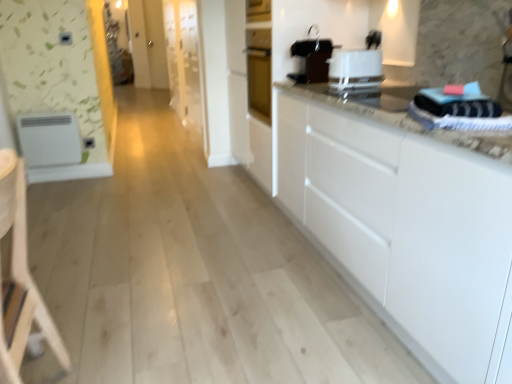
Consider the image. How much space does white matte refrigerator at left, arranged as the first appliance when viewed from the back, occupy horizontally?

white matte refrigerator at left, arranged as the first appliance when viewed from the back, is 5.27 inches wide.

Describe the element at coordinates (20, 281) in the screenshot. I see `light wood armchair at left` at that location.

The width and height of the screenshot is (512, 384). Find the location of `light wood armchair at left`. light wood armchair at left is located at coordinates (20, 281).

This screenshot has height=384, width=512. In order to click on black plastic coffee maker at upper center, the 2th appliance positioned from the left in this screenshot , I will do `click(312, 58)`.

Find the location of a particular element. The width and height of the screenshot is (512, 384). white matte refrigerator at left, the first appliance in the bottom-to-top sequence is located at coordinates (50, 139).

From the picture: Is white glossy toaster at upper center oriented away from black plastic coffee maker at upper center, the 2th appliance positioned from the left?

white glossy toaster at upper center does not have its back to black plastic coffee maker at upper center, the 2th appliance positioned from the left.

Is the position of white glossy toaster at upper center less distant than that of black plastic coffee maker at upper center, which appears as the 2th appliance when viewed from the back?

That is True.

From the image's perspective, is white glossy toaster at upper center located above black plastic coffee maker at upper center, the 2th appliance positioned from the left?

Actually, white glossy toaster at upper center appears below black plastic coffee maker at upper center, the 2th appliance positioned from the left, in the image.

Can you confirm if white matte refrigerator at left, the 2th appliance when ordered from top to bottom, is shorter than white glossy toaster at upper center?

No.

Between point (65, 112) and point (373, 54), which one is positioned behind?

The point (65, 112) is farther from the camera.

Is white matte refrigerator at left, arranged as the first appliance when viewed from the back, outside of white glossy toaster at upper center?

That's correct, white matte refrigerator at left, arranged as the first appliance when viewed from the back, is outside of white glossy toaster at upper center.

From a real-world perspective, is white matte refrigerator at left, the 2th appliance when ordered from top to bottom, below white glossy toaster at upper center?

Yes, from a real-world perspective, white matte refrigerator at left, the 2th appliance when ordered from top to bottom, is below white glossy toaster at upper center.

Is light wood armchair at left facing away from white glossy toaster at upper center?

No, light wood armchair at left is not facing the opposite direction of white glossy toaster at upper center.

Which object is positioned more to the left, light wood armchair at left or white glossy toaster at upper center?

light wood armchair at left.

From the image's perspective, does light wood armchair at left appear higher than white glossy toaster at upper center?

No, from the image's perspective, light wood armchair at left is not above white glossy toaster at upper center.

Is light wood armchair at left taller or shorter than white glossy toaster at upper center?

In the image, light wood armchair at left appears to be taller than white glossy toaster at upper center.

Is black plastic coffee maker at upper center, the 2th appliance positioned from the left, to the left of light wood armchair at left from the viewer's perspective?

Incorrect, black plastic coffee maker at upper center, the 2th appliance positioned from the left, is not on the left side of light wood armchair at left.

Is black plastic coffee maker at upper center, which appears as the first appliance when viewed from the front, completely or partially outside of light wood armchair at left?

Yes, black plastic coffee maker at upper center, which appears as the first appliance when viewed from the front, is outside of light wood armchair at left.

Are black plastic coffee maker at upper center, which is the 2th appliance in bottom-to-top order, and light wood armchair at left beside each other?

There is a gap between black plastic coffee maker at upper center, which is the 2th appliance in bottom-to-top order, and light wood armchair at left.

How far apart are black plastic coffee maker at upper center, placed as the 1th appliance when sorted from right to left, and light wood armchair at left?

black plastic coffee maker at upper center, placed as the 1th appliance when sorted from right to left, is 5.70 feet from light wood armchair at left.

This screenshot has height=384, width=512. Find the location of `the 1st appliance behind the white glossy toaster at upper center`. the 1st appliance behind the white glossy toaster at upper center is located at coordinates (312, 58).

Does black plastic coffee maker at upper center, which is counted as the first appliance, starting from the top, have a greater width compared to white glossy toaster at upper center?

Incorrect, the width of black plastic coffee maker at upper center, which is counted as the first appliance, starting from the top, does not surpass that of white glossy toaster at upper center.

Is black plastic coffee maker at upper center, the 2th appliance positioned from the left, taller than white glossy toaster at upper center?

Yes.

Looking at this image, which object is positioned more to the right, black plastic coffee maker at upper center, the 2th appliance positioned from the left, or white glossy toaster at upper center?

Positioned to the right is white glossy toaster at upper center.

This screenshot has width=512, height=384. In order to click on armchair located in front of the white matte refrigerator at left, the first appliance in the bottom-to-top sequence in this screenshot , I will do `click(20, 281)`.

Consider the image. Is white matte refrigerator at left, arranged as the first appliance when viewed from the back, smaller than light wood armchair at left?

Yes, white matte refrigerator at left, arranged as the first appliance when viewed from the back, is smaller than light wood armchair at left.

Can you confirm if white matte refrigerator at left, the 2th appliance when ordered from top to bottom, is thinner than light wood armchair at left?

Yes, white matte refrigerator at left, the 2th appliance when ordered from top to bottom, is thinner than light wood armchair at left.

From the image's perspective, is white matte refrigerator at left, arranged as the 2th appliance when viewed from the front, positioned above or below light wood armchair at left?

white matte refrigerator at left, arranged as the 2th appliance when viewed from the front, is above light wood armchair at left.

Find the location of a particular element. The image size is (512, 384). the 1st appliance behind when counting from the light wood armchair at left is located at coordinates (312, 58).

From the image's perspective, is light wood armchair at left positioned above or below black plastic coffee maker at upper center, which is counted as the first appliance, starting from the top?

Based on their image positions, light wood armchair at left is located beneath black plastic coffee maker at upper center, which is counted as the first appliance, starting from the top.

In the scene shown: Is light wood armchair at left to the left of black plastic coffee maker at upper center, which appears as the 2th appliance when viewed from the back, from the viewer's perspective?

Correct, you'll find light wood armchair at left to the left of black plastic coffee maker at upper center, which appears as the 2th appliance when viewed from the back.

You are a GUI agent. You are given a task and a screenshot of the screen. Output one action in this format:
    pyautogui.click(x=<x>, y=<y>)
    Task: Click on the appliance positioned vertically above the white glossy toaster at upper center (from a real-world perspective)
    Image resolution: width=512 pixels, height=384 pixels.
    Given the screenshot: What is the action you would take?
    pyautogui.click(x=312, y=58)

Identify the location of appliance below the white glossy toaster at upper center (from a real-world perspective). The height and width of the screenshot is (384, 512). (50, 139).

From the image, which object appears to be farther from black plastic coffee maker at upper center, which is the 2th appliance in bottom-to-top order, light wood armchair at left or white matte refrigerator at left, the 2th appliance when ordered from top to bottom?

white matte refrigerator at left, the 2th appliance when ordered from top to bottom, lies further to black plastic coffee maker at upper center, which is the 2th appliance in bottom-to-top order, than the other object.

Which object lies nearer to the anchor point white matte refrigerator at left, placed as the second appliance when sorted from right to left, light wood armchair at left or white glossy toaster at upper center?

The object closer to white matte refrigerator at left, placed as the second appliance when sorted from right to left, is light wood armchair at left.

Which object lies further to the anchor point white glossy toaster at upper center, light wood armchair at left or black plastic coffee maker at upper center, which is the 2th appliance in bottom-to-top order?

light wood armchair at left.

Looking at the image, which one is located closer to white matte refrigerator at left, placed as the second appliance when sorted from right to left, black plastic coffee maker at upper center, which appears as the 2th appliance when viewed from the back, or white glossy toaster at upper center?

Among the two, black plastic coffee maker at upper center, which appears as the 2th appliance when viewed from the back, is located nearer to white matte refrigerator at left, placed as the second appliance when sorted from right to left.

Based on their spatial positions, is white matte refrigerator at left, arranged as the first appliance when viewed from the back, or white glossy toaster at upper center further from light wood armchair at left?

Among the two, white matte refrigerator at left, arranged as the first appliance when viewed from the back, is located further to light wood armchair at left.

Estimate the real-world distances between objects in this image. Which object is closer to white matte refrigerator at left, which is counted as the 1th appliance, starting from the left, white glossy toaster at upper center or light wood armchair at left?

The object closer to white matte refrigerator at left, which is counted as the 1th appliance, starting from the left, is light wood armchair at left.

Looking at the image, which one is located closer to white matte refrigerator at left, the 2th appliance when ordered from top to bottom, light wood armchair at left or black plastic coffee maker at upper center, placed as the 1th appliance when sorted from right to left?

light wood armchair at left.

Considering their positions, is black plastic coffee maker at upper center, which appears as the 2th appliance when viewed from the back, positioned further to white glossy toaster at upper center than white matte refrigerator at left, arranged as the 2th appliance when viewed from the front?

white matte refrigerator at left, arranged as the 2th appliance when viewed from the front.

The width and height of the screenshot is (512, 384). In order to click on appliance located between white matte refrigerator at left, placed as the second appliance when sorted from right to left, and white glossy toaster at upper center in the left-right direction in this screenshot , I will do `click(312, 58)`.

The height and width of the screenshot is (384, 512). I want to click on appliance between light wood armchair at left and white matte refrigerator at left, arranged as the 2th appliance when viewed from the front, from front to back, so click(x=312, y=58).

At what (x,y) coordinates should I click in order to perform the action: click on home appliance located between light wood armchair at left and white matte refrigerator at left, the first appliance in the bottom-to-top sequence, in the depth direction. Please return your answer as a coordinate pair (x, y). Looking at the image, I should click on (355, 70).

This screenshot has width=512, height=384. I want to click on home appliance between light wood armchair at left and black plastic coffee maker at upper center, which appears as the first appliance when viewed from the front, along the z-axis, so click(x=355, y=70).